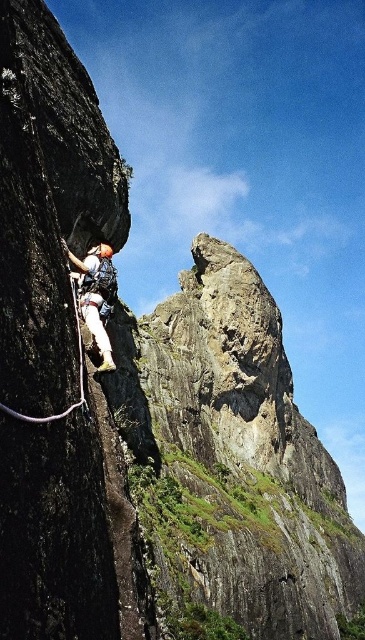
Question: Does white climbing harness at left have a lesser width compared to white nylon rope at left?

Choices:
 (A) yes
 (B) no

Answer: (B)

Question: Is white climbing harness at left bigger than white nylon rope at left?

Choices:
 (A) yes
 (B) no

Answer: (A)

Question: Is white climbing harness at left thinner than white nylon rope at left?

Choices:
 (A) no
 (B) yes

Answer: (A)